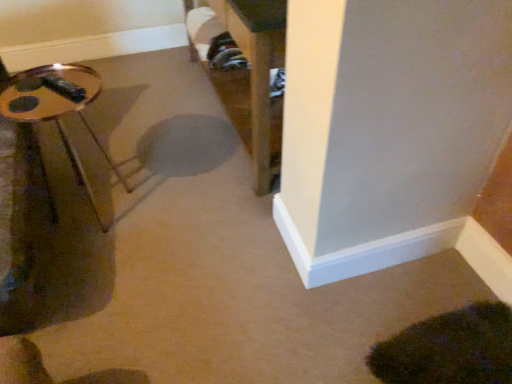
Image resolution: width=512 pixels, height=384 pixels. In order to click on free point behind metallic glass table at left in this screenshot , I will do 121,160.